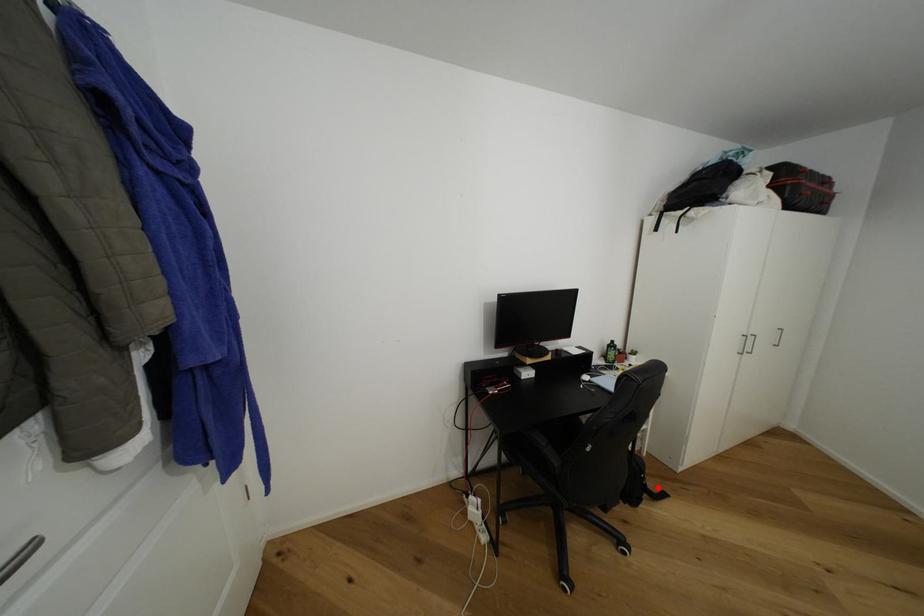
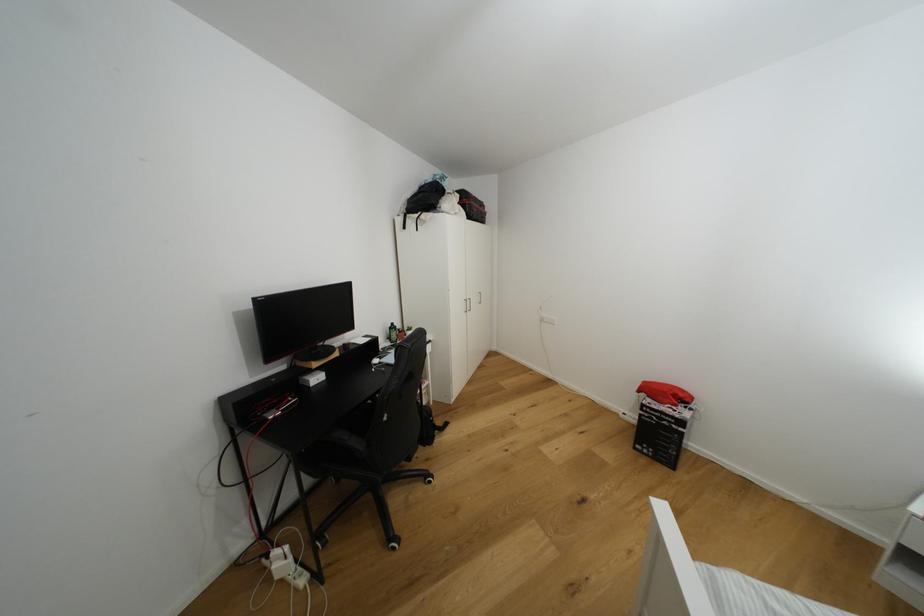
Find the pixel in the second image that matches the highlighted location in the first image.

(444, 424)